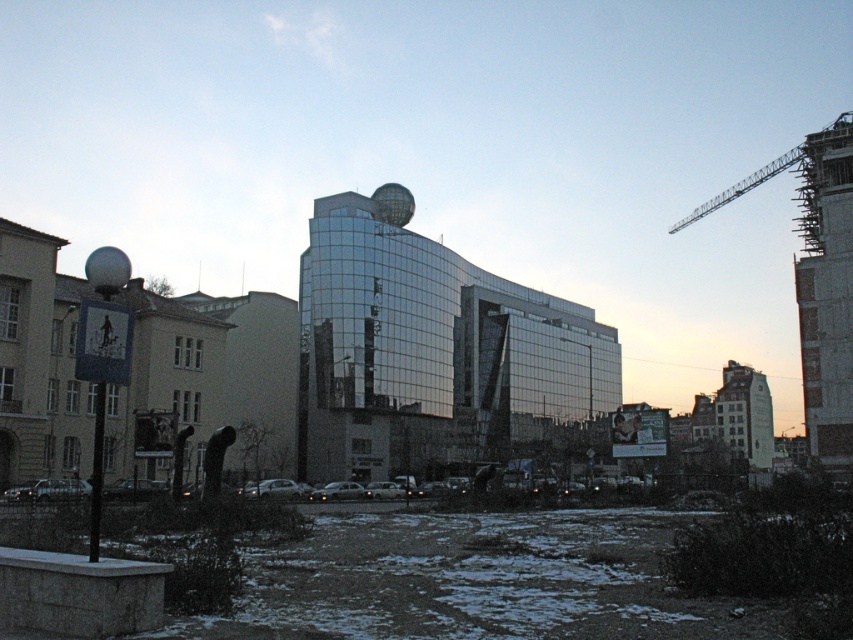
Question: Among these points, which one is nearest to the camera?

Choices:
 (A) click(796, 168)
 (B) click(393, 349)

Answer: (A)

Question: Which point is farther to the camera?

Choices:
 (A) metallic gray crane at upper right
 (B) glossy glass building at center

Answer: (B)

Question: Is the position of glossy glass building at center more distant than that of metallic gray crane at upper right?

Choices:
 (A) no
 (B) yes

Answer: (B)

Question: Does glossy glass building at center appear on the right side of metallic gray crane at upper right?

Choices:
 (A) no
 (B) yes

Answer: (A)

Question: Observing the image, what is the correct spatial positioning of glossy glass building at center in reference to metallic gray crane at upper right?

Choices:
 (A) right
 (B) left

Answer: (B)